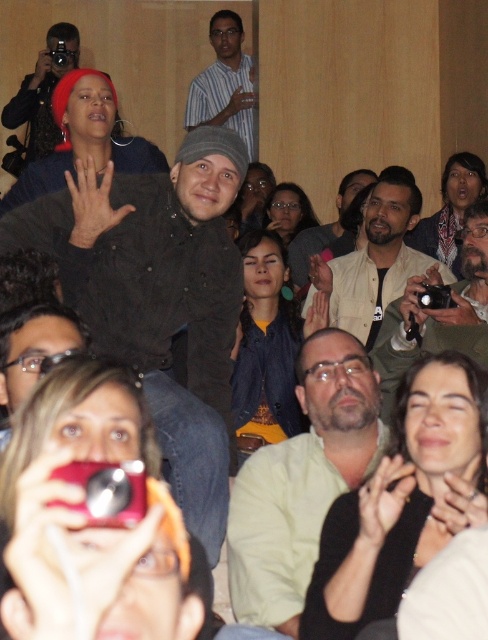
You are standing at the center of the room and want to take a photo of the person in the red headscarf. The room has a 1.2 meter wide doorway to your left. Is the matte pink camera at lower left within reach from your current position to capture the photo without crossing the doorway?

The matte pink camera at lower left is positioned at point [81,513]. Since you are at the center, you can reach it without needing to cross the doorway. Therefore, you can take the photo using the matte pink camera at lower left.

You are standing at the center of the room and see a person wearing a red headscarf and a dark jacket. There is also a matte pink camera at lower left located at point (x=81, y=513). Which object is closer to you?

The person wearing a red headscarf and a dark jacket is closer to you than the matte pink camera at lower left located at point (x=81, y=513) because the person is in the foreground while the camera is at a specific coordinate point which might be further away.